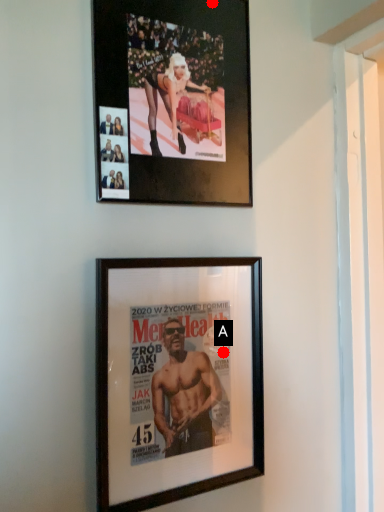
Question: Two points are circled on the image, labeled by A and B beside each circle. Which point appears closest to the camera in this image?

Choices:
 (A) A is closer
 (B) B is closer

Answer: (B)